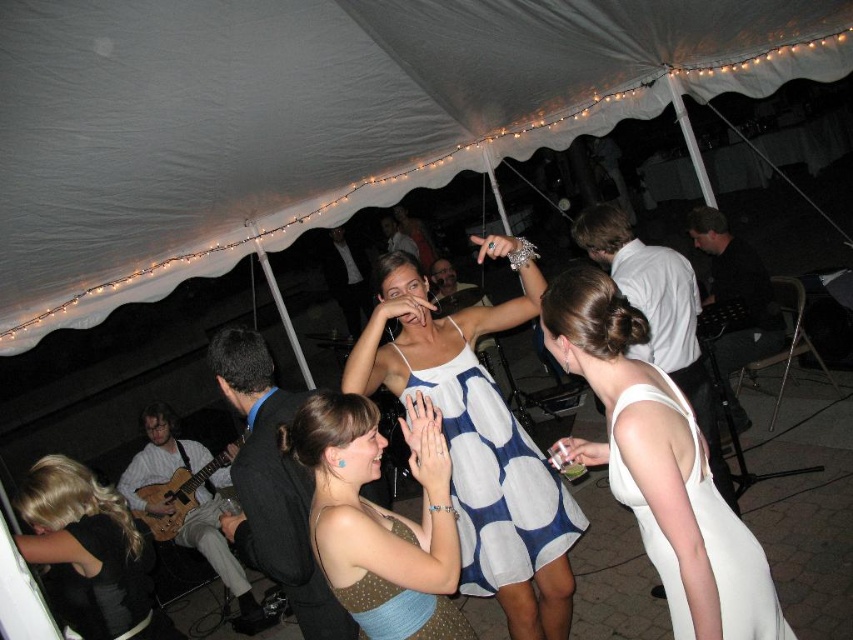
Question: Is polka dot dress at center thinner than black leather jacket at lower left?

Choices:
 (A) no
 (B) yes

Answer: (A)

Question: Which object is closer to the camera taking this photo?

Choices:
 (A) black leather jacket at lower left
 (B) blue dotted fabric dress at center

Answer: (B)

Question: Is the position of white fabric canopy at upper center more distant than that of blue dotted fabric dress at center?

Choices:
 (A) no
 (B) yes

Answer: (B)

Question: Which object is farther from the camera taking this photo?

Choices:
 (A) blue dotted fabric dress at center
 (B) white dotted fabric dress at center

Answer: (B)

Question: From the image, what is the correct spatial relationship of polka dot dress at center in relation to white satin dress at lower right?

Choices:
 (A) right
 (B) left

Answer: (B)

Question: Which point is farther to the camera?

Choices:
 (A) (73, 588)
 (B) (439, 376)
 (C) (672, 612)

Answer: (B)